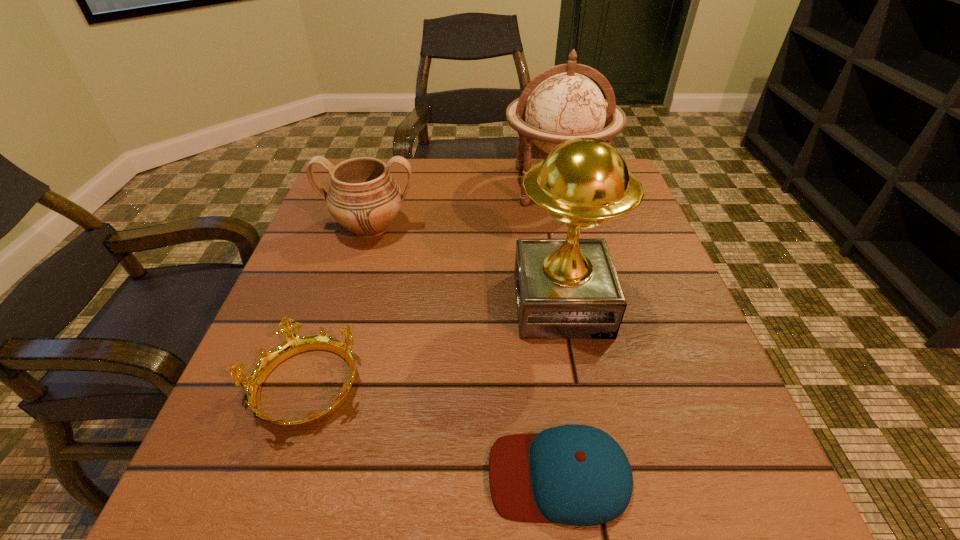
Where is `vacant region between the crown and the shortest object`? The image size is (960, 540). vacant region between the crown and the shortest object is located at coordinates (432, 431).

Find the location of a particular element. free point between the third nearest object and the urn is located at coordinates (467, 266).

Where is `free space between the shortest object and the award`? This screenshot has width=960, height=540. free space between the shortest object and the award is located at coordinates (561, 389).

Find the location of a particular element. empty space that is in between the baseball cap and the award is located at coordinates (561, 389).

Find the location of a particular element. The width and height of the screenshot is (960, 540). vacant area that lies between the urn and the crown is located at coordinates (338, 307).

Find the location of a particular element. object that stands as the closest to the shortest object is located at coordinates (568, 288).

Locate which object ranks fourth in proximity to the third farthest object. Please provide its 2D coordinates. Your answer should be formatted as a tuple, i.e. [(x, y)], where the tuple contains the x and y coordinates of a point satisfying the conditions above.

[(294, 344)]

Image resolution: width=960 pixels, height=540 pixels. Find the location of `vacant point that satisfies the following two spatial constraints: 1. on the front-facing side of the globe; 2. on the front-facing side of the award`. vacant point that satisfies the following two spatial constraints: 1. on the front-facing side of the globe; 2. on the front-facing side of the award is located at coordinates (584, 304).